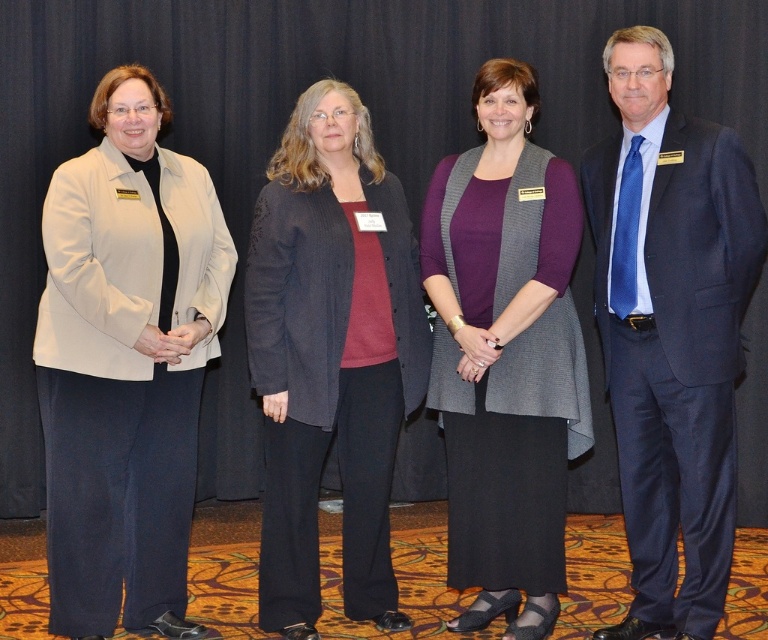
Is blue textured suit at right to the right of dark gray textured cardigan at center from the viewer's perspective?

Indeed, blue textured suit at right is positioned on the right side of dark gray textured cardigan at center.

Based on the photo, who is positioned more to the left, blue textured suit at right or dark gray textured cardigan at center?

dark gray textured cardigan at center is more to the left.

Identify the location of blue textured suit at right. (672, 332).

This screenshot has height=640, width=768. What do you see at coordinates (330, 355) in the screenshot?
I see `dark gray textured cardigan at center` at bounding box center [330, 355].

Is point (270, 312) positioned after point (533, 589)?

That is False.

In order to click on dark gray textured cardigan at center in this screenshot , I will do `click(330, 355)`.

Does beige fabric jacket at left lie behind purple matte sweater at center?

No.

Is point (111, 310) more distant than point (478, 486)?

No, it is not.

Locate an element on the screen. The image size is (768, 640). beige fabric jacket at left is located at coordinates (124, 364).

Locate an element on the screen. The width and height of the screenshot is (768, 640). beige fabric jacket at left is located at coordinates (124, 364).